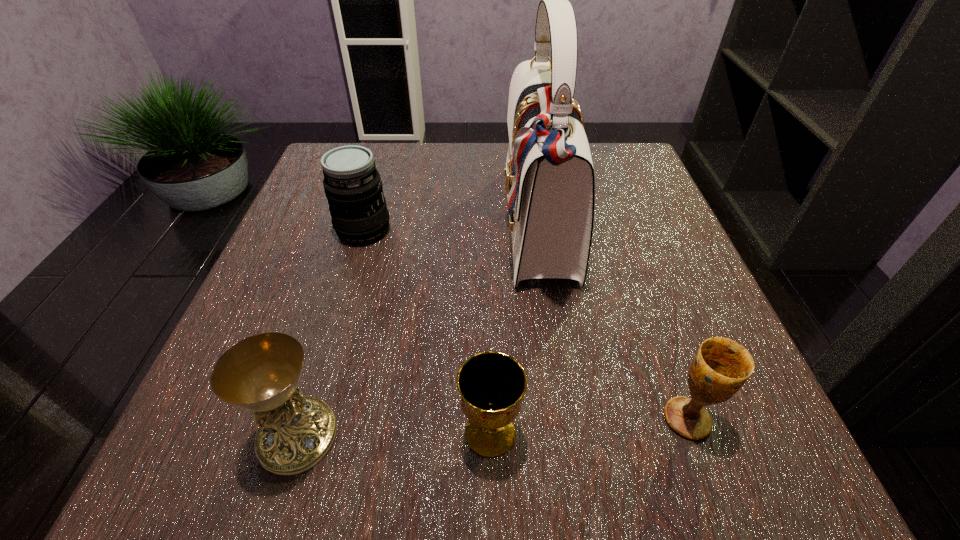
Identify the location of vacant space located on the back of the rightmost chalice. This screenshot has height=540, width=960. (627, 248).

The width and height of the screenshot is (960, 540). Identify the location of free space located on the back of the second chalice from right to left. (489, 336).

I want to click on object that is at the far edge, so click(550, 186).

Identify the location of telephoto lens that is at the left edge. The image size is (960, 540). (353, 187).

At what (x,y) coordinates should I click in order to perform the action: click on chalice located at the left edge. Please return your answer as a coordinate pair (x, y). Looking at the image, I should click on (260, 373).

Identify the location of object that is at the right edge. (721, 366).

Where is `object present at the near left corner`? This screenshot has height=540, width=960. object present at the near left corner is located at coordinates (260, 373).

Identify the location of object present at the near right corner. The height and width of the screenshot is (540, 960). (721, 366).

The image size is (960, 540). I want to click on free space at the far edge of the desktop, so click(500, 164).

In the image, there is a desktop. Identify the location of vacant space at the near edge. Image resolution: width=960 pixels, height=540 pixels. (625, 439).